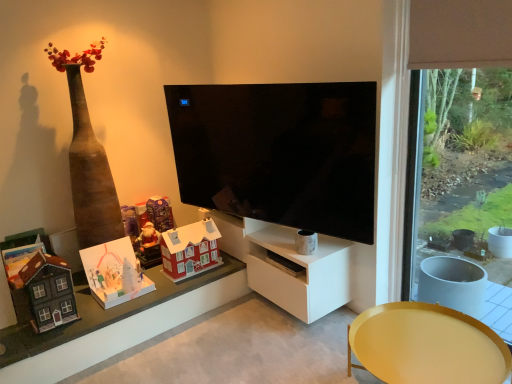
Find the location of `wooden house at lower left, the fifth toy from the back`. wooden house at lower left, the fifth toy from the back is located at coordinates (49, 292).

Image resolution: width=512 pixels, height=384 pixels. Describe the element at coordinates (190, 250) in the screenshot. I see `matte red house at center, acting as the third toy starting from the back` at that location.

The height and width of the screenshot is (384, 512). What do you see at coordinates (117, 324) in the screenshot?
I see `matte red house at lower left` at bounding box center [117, 324].

The height and width of the screenshot is (384, 512). Describe the element at coordinates (114, 273) in the screenshot. I see `white paper pop-up at lower left, arranged as the 2th toy when viewed from the front` at that location.

Locate an element on the screen. The image size is (512, 384). white matte tv cabinet at center is located at coordinates (298, 273).

Does matte black tv at center have a lesser width compared to wooden house at lower left, the 1th toy when ordered from front to back?

Yes, matte black tv at center is thinner than wooden house at lower left, the 1th toy when ordered from front to back.

How distant is matte black tv at center from wooden house at lower left, the fifth toy from the back?

matte black tv at center and wooden house at lower left, the fifth toy from the back, are 1.32 meters apart from each other.

Which object is positioned more to the left, matte black tv at center or wooden house at lower left, the 1th toy when ordered from front to back?

From the viewer's perspective, wooden house at lower left, the 1th toy when ordered from front to back, appears more on the left side.

Which of these two, matte black tv at center or wooden house at lower left, the 1th toy when ordered from front to back, is smaller?

With smaller size is wooden house at lower left, the 1th toy when ordered from front to back.

From a real-world perspective, relative to white paper pop-up at lower left, which is the 4th toy in back-to-front order, is matte yellow tray at lower right vertically above or below?

matte yellow tray at lower right is situated lower than white paper pop-up at lower left, which is the 4th toy in back-to-front order, in the real world.

From the matte yellow tray at lower right, count the 4th toy to the left and point to it. Please provide its 2D coordinates.

[(114, 273)]

Is point (422, 342) in front of point (120, 303)?

That is True.

Is matte red house at lower left with brown wood frame at right?

No, matte red house at lower left is not making contact with brown wood frame at right.

Would you say matte red house at lower left contains brown wood frame at right?

No, brown wood frame at right is not inside matte red house at lower left.

Which of these two, matte red house at lower left or brown wood frame at right, is wider?

With larger width is matte red house at lower left.

Can you confirm if matte red house at lower left is taller than brown wood frame at right?

No, matte red house at lower left is not taller than brown wood frame at right.

Is matte red house at lower left at the back of matte red house at center, which appears as the third toy when viewed from the front?

That's not correct — matte red house at center, which appears as the third toy when viewed from the front, is not looking away from matte red house at lower left.

Which point is more distant from viewer, (184, 254) or (60, 339)?

Point (184, 254)

Is matte red house at lower left a part of matte red house at center, which appears as the third toy when viewed from the front?

No, matte red house at center, which appears as the third toy when viewed from the front, does not contain matte red house at lower left.

Between matte red house at center, acting as the third toy starting from the back, and matte red house at lower left, which one appears on the right side from the viewer's perspective?

matte red house at center, acting as the third toy starting from the back.

Where is `the 4th toy behind the brown wood frame at right, counting from the anchor's position`? This screenshot has width=512, height=384. the 4th toy behind the brown wood frame at right, counting from the anchor's position is located at coordinates (148, 228).

Is matte plastic santa at center, positioned as the second toy in back-to-front order, looking in the opposite direction of brown wood frame at right?

matte plastic santa at center, positioned as the second toy in back-to-front order, does not have its back to brown wood frame at right.

How different are the orientations of matte plastic santa at center, positioned as the second toy in back-to-front order, and brown wood frame at right in degrees?

89.9 degrees separate the facing orientations of matte plastic santa at center, positioned as the second toy in back-to-front order, and brown wood frame at right.

From a real-world perspective, who is located higher, matte plastic santa at center, which is the fourth toy in front-to-back order, or brown wood frame at right?

brown wood frame at right is physically above.

Which object is positioned more to the right, matte red house at lower left or matte plastic santa at center, which is the fourth toy in front-to-back order?

Positioned to the right is matte plastic santa at center, which is the fourth toy in front-to-back order.

Considering their positions, is matte red house at lower left located in front of or behind matte plastic santa at center, positioned as the second toy in back-to-front order?

In the image, matte red house at lower left appears in front of matte plastic santa at center, positioned as the second toy in back-to-front order.

From the image's perspective, is matte red house at lower left above or below matte plastic santa at center, positioned as the second toy in back-to-front order?

Clearly, from the image's perspective, matte red house at lower left is below matte plastic santa at center, positioned as the second toy in back-to-front order.

Is matte black tv at center inside the boundaries of white matte tv cabinet at center, or outside?

matte black tv at center is not inside white matte tv cabinet at center, it's outside.

Is matte black tv at center facing towards white matte tv cabinet at center?

No.

Considering the positions of objects matte black tv at center and white matte tv cabinet at center in the image provided, who is in front, matte black tv at center or white matte tv cabinet at center?

matte black tv at center is more forward.

Image resolution: width=512 pixels, height=384 pixels. What are the coordinates of `the 1st toy behind the matte black tv at center` in the screenshot? It's located at (x=49, y=292).

The width and height of the screenshot is (512, 384). I want to click on toy that is the 4th one when counting leftward from the matte yellow tray at lower right, so click(114, 273).

Considering their positions, is brown wood frame at right positioned closer to white matte tv cabinet at center than matte red house at lower left?

matte red house at lower left.

From the image, which object appears to be farther from brown wood frame at right, matte black tv at center or matte yellow tray at lower right?

matte yellow tray at lower right is positioned further to the anchor brown wood frame at right.

From the image, which object appears to be farther from white matte tv cabinet at center, matte red house at lower left or matte plastic santa at center, which is the fourth toy in front-to-back order?

matte plastic santa at center, which is the fourth toy in front-to-back order, lies further to white matte tv cabinet at center than the other object.

When comparing their distances from matte plastic santa at center, which is the fourth toy in front-to-back order, does matte red house at center, acting as the third toy starting from the back, or brown wood frame at right seem closer?

Among the two, matte red house at center, acting as the third toy starting from the back, is located nearer to matte plastic santa at center, which is the fourth toy in front-to-back order.

Estimate the real-world distances between objects in this image. Which object is closer to wooden house at lower left, the 1th toy when ordered from front to back, matte red house at lower left or brown wood frame at right?

Based on the image, matte red house at lower left appears to be nearer to wooden house at lower left, the 1th toy when ordered from front to back.

Estimate the real-world distances between objects in this image. Which object is closer to matte purple cardboard at upper left, the 5th toy when ordered from front to back, white matte tv cabinet at center or matte red house at center, acting as the third toy starting from the back?

Based on the image, matte red house at center, acting as the third toy starting from the back, appears to be nearer to matte purple cardboard at upper left, the 5th toy when ordered from front to back.

When comparing their distances from matte purple cardboard at upper left, acting as the first toy starting from the back, does white paper pop-up at lower left, which is the 4th toy in back-to-front order, or matte red house at lower left seem closer?

Based on the image, white paper pop-up at lower left, which is the 4th toy in back-to-front order, appears to be nearer to matte purple cardboard at upper left, acting as the first toy starting from the back.

Based on the photo, considering their positions, is matte plastic santa at center, which is the fourth toy in front-to-back order, positioned further to brown wood frame at right than matte purple cardboard at upper left, acting as the first toy starting from the back?

The object further to brown wood frame at right is matte purple cardboard at upper left, acting as the first toy starting from the back.

The height and width of the screenshot is (384, 512). I want to click on television between matte yellow tray at lower right and matte purple cardboard at upper left, acting as the first toy starting from the back, from front to back, so click(279, 153).

The image size is (512, 384). Find the location of `tv cabinet between matte black tv at center and brown wood frame at right from left to right`. tv cabinet between matte black tv at center and brown wood frame at right from left to right is located at coordinates (298, 273).

Where is `window positioned between matte black tv at center and matte plastic santa at center, positioned as the second toy in back-to-front order, from near to far`? window positioned between matte black tv at center and matte plastic santa at center, positioned as the second toy in back-to-front order, from near to far is located at coordinates (117, 324).

The image size is (512, 384). I want to click on tv cabinet located between matte purple cardboard at upper left, acting as the first toy starting from the back, and brown wood frame at right in the left-right direction, so click(x=298, y=273).